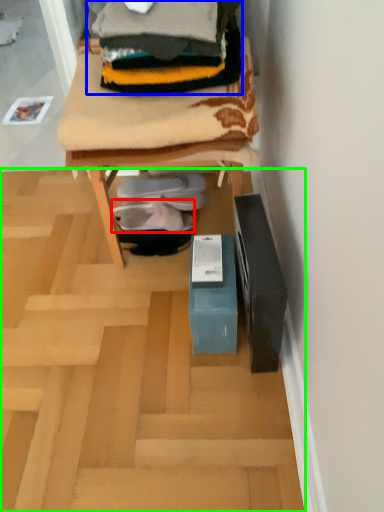
Question: Which object is the farthest from footwear (highlighted by a red box)? Choose among these: clothing (highlighted by a blue box) or furnurniture (highlighted by a green box).

Choices:
 (A) clothing
 (B) furnurniture

Answer: (A)